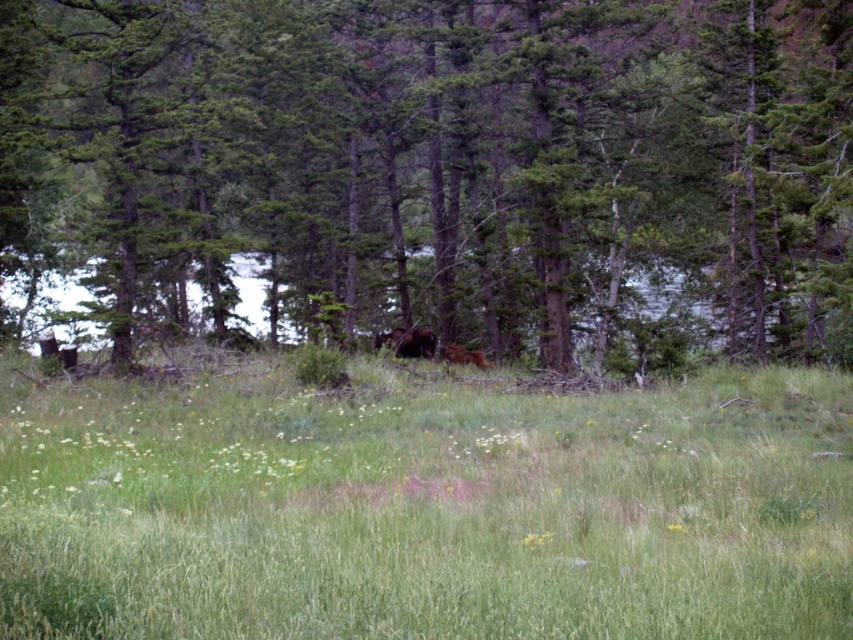
You are a hiker standing in the forest and see the green textured tree at center and the brown furry bear at center. Which object is nearer to you?

The green textured tree at center is closer to the viewer than the brown furry bear at center.

You are standing in the middle of the forest and notice both the green textured tree at center and the green grassy field at center. Which one has a wider spread from left to right?

The green textured tree at center has a larger width than the green grassy field at center according to the description.